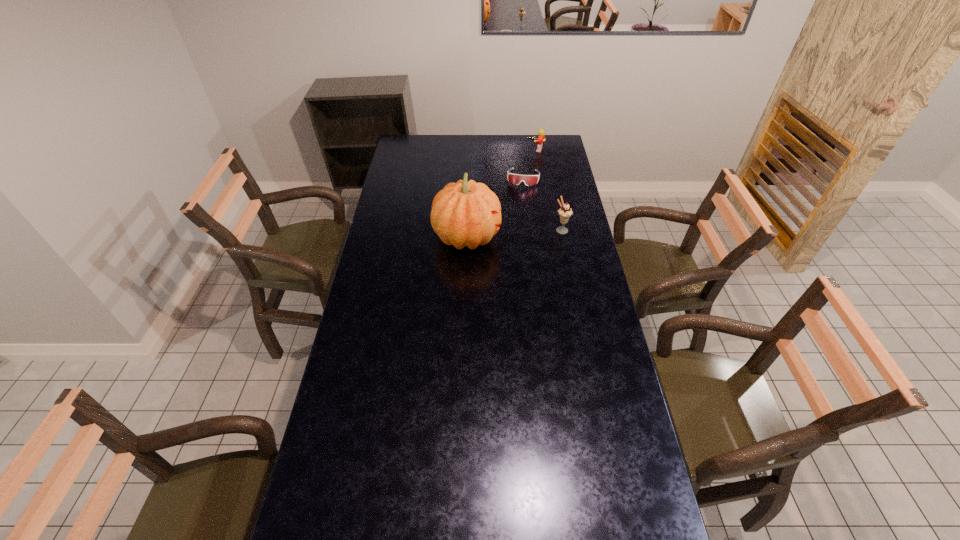
Identify the location of free space between the Lego and the icecream. This screenshot has height=540, width=960. (548, 190).

At what (x,y) coordinates should I click in order to perform the action: click on empty space between the second shortest object and the tallest object. Please return your answer as a coordinate pair (x, y). The image size is (960, 540). Looking at the image, I should click on (501, 193).

Find the location of a particular element. Image resolution: width=960 pixels, height=540 pixels. empty location between the third tallest object and the shortest object is located at coordinates (529, 164).

Find the location of a particular element. The height and width of the screenshot is (540, 960). object that stands as the third closest to the leftmost object is located at coordinates (541, 137).

The height and width of the screenshot is (540, 960). What are the coordinates of `the second closest object to the second farthest object` in the screenshot? It's located at (464, 213).

Where is `free point that satisfies the following two spatial constraints: 1. on the front side of the third nearest object; 2. on the left side of the icecream`? free point that satisfies the following two spatial constraints: 1. on the front side of the third nearest object; 2. on the left side of the icecream is located at coordinates (529, 230).

The image size is (960, 540). Identify the location of vacant space that satisfies the following two spatial constraints: 1. on the front side of the Lego; 2. on the right side of the icecream. (548, 230).